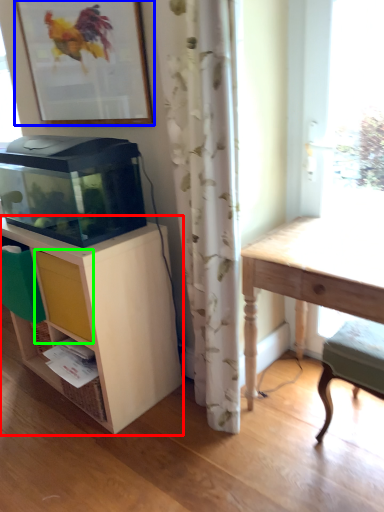
Question: Which is farther away from shelf (highlighted by a red box)? picture frame (highlighted by a blue box) or drawer (highlighted by a green box)?

Choices:
 (A) picture frame
 (B) drawer

Answer: (A)